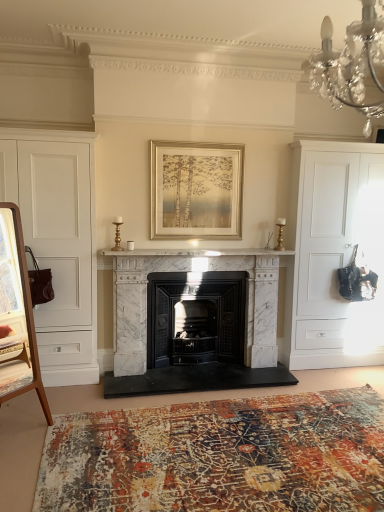
Question: Is white marble fireplace at center, which ranks as the 1th fireplace in right-to-left order, situated inside textured rug at lower center or outside?

Choices:
 (A) inside
 (B) outside

Answer: (B)

Question: Considering the positions of white marble fireplace at center, which ranks as the 1th fireplace in right-to-left order, and textured rug at lower center in the image, is white marble fireplace at center, which ranks as the 1th fireplace in right-to-left order, bigger or smaller than textured rug at lower center?

Choices:
 (A) small
 (B) big

Answer: (B)

Question: Which object is the farthest from the white marble fireplace at center, which ranks as the 1th fireplace in right-to-left order?

Choices:
 (A) textured rug at lower center
 (B) white matte cabinet at right, the second cabinetry when ordered from left to right
 (C) white matte cabinet at left, which ranks as the second cabinetry in right-to-left order
 (D) gold metallic picture frame at center
 (E) white marble fireplace at center

Answer: (A)

Question: Which of these objects is positioned farthest from the white matte cabinet at left, the first cabinetry when ordered from left to right?

Choices:
 (A) gold metallic picture frame at center
 (B) white marble fireplace at center
 (C) black cast iron fireplace at center, which appears as the 2th fireplace when viewed from the right
 (D) white matte cabinet at right, the second cabinetry when ordered from left to right
 (E) textured rug at lower center

Answer: (D)